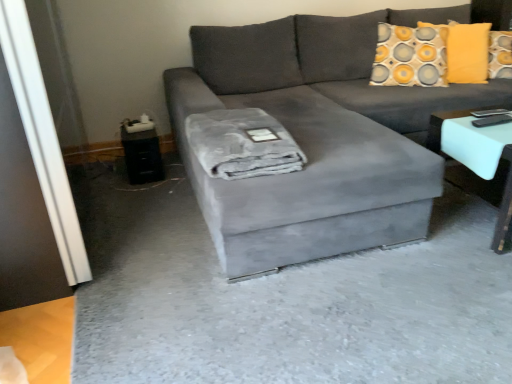
Question: Considering their positions, is black plastic side table at lower left located in front of or behind white glossy table at right?

Choices:
 (A) front
 (B) behind

Answer: (B)

Question: From a real-world perspective, is black plastic side table at lower left physically located above or below white glossy table at right?

Choices:
 (A) below
 (B) above

Answer: (A)

Question: Which object is the closest to the velvet gray couch at center?

Choices:
 (A) black plastic side table at lower left
 (B) transparent glass door at left
 (C) velvet gray ottoman at center
 (D) gray plush blanket at center
 (E) white glossy table at right

Answer: (D)

Question: Estimate the real-world distances between objects in this image. Which object is closer to the velvet gray ottoman at center?

Choices:
 (A) gray plush blanket at center
 (B) transparent glass door at left
 (C) white glossy table at right
 (D) velvet gray couch at center
 (E) black plastic side table at lower left

Answer: (D)